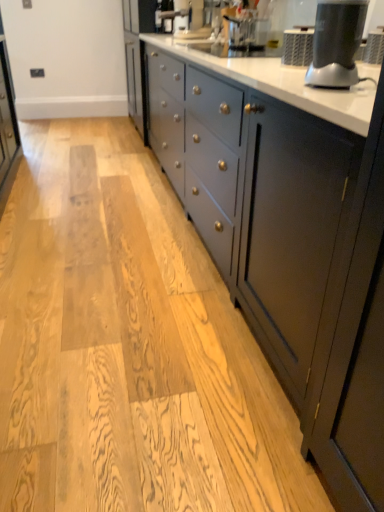
Question: Is white glossy countertop at center in front of matte black blender at upper right?

Choices:
 (A) no
 (B) yes

Answer: (B)

Question: From the image's perspective, would you say white glossy countertop at center is shown under matte black blender at upper right?

Choices:
 (A) yes
 (B) no

Answer: (B)

Question: From the image's perspective, would you say white glossy countertop at center is positioned over matte black blender at upper right?

Choices:
 (A) yes
 (B) no

Answer: (A)

Question: Is white glossy countertop at center placed right next to matte black blender at upper right?

Choices:
 (A) no
 (B) yes

Answer: (A)

Question: Is matte black blender at upper right located within white glossy countertop at center?

Choices:
 (A) no
 (B) yes

Answer: (B)

Question: From a real-world perspective, is white glossy countertop at center above or below matte black coffee machine at upper center?

Choices:
 (A) below
 (B) above

Answer: (A)

Question: In terms of height, does white glossy countertop at center look taller or shorter compared to matte black coffee machine at upper center?

Choices:
 (A) tall
 (B) short

Answer: (A)

Question: Considering the positions of white glossy countertop at center and matte black coffee machine at upper center in the image, is white glossy countertop at center bigger or smaller than matte black coffee machine at upper center?

Choices:
 (A) small
 (B) big

Answer: (B)

Question: Visually, is white glossy countertop at center positioned to the left or to the right of matte black coffee machine at upper center?

Choices:
 (A) left
 (B) right

Answer: (A)

Question: Is matte black blender at upper right in front of or behind white glossy countertop at center in the image?

Choices:
 (A) behind
 (B) front

Answer: (A)

Question: Is matte black blender at upper right taller or shorter than white glossy countertop at center?

Choices:
 (A) tall
 (B) short

Answer: (B)

Question: Is matte black blender at upper right bigger or smaller than white glossy countertop at center?

Choices:
 (A) big
 (B) small

Answer: (B)

Question: From a real-world perspective, is matte black blender at upper right physically located above or below white glossy countertop at center?

Choices:
 (A) above
 (B) below

Answer: (A)

Question: Do you think white glossy countertop at center is within matte black blender at upper right, or outside of it?

Choices:
 (A) outside
 (B) inside

Answer: (A)

Question: From the image's perspective, is white glossy countertop at center above or below matte black blender at upper right?

Choices:
 (A) below
 (B) above

Answer: (B)